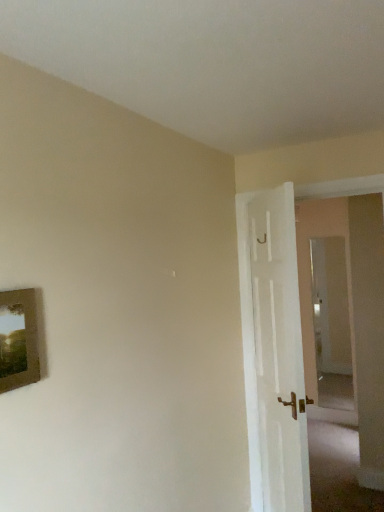
Question: From the image's perspective, is transparent glass door at right beneath wooden picture frame at left?

Choices:
 (A) no
 (B) yes

Answer: (B)

Question: Can you confirm if transparent glass door at right is thinner than wooden picture frame at left?

Choices:
 (A) no
 (B) yes

Answer: (B)

Question: Is the surface of transparent glass door at right in direct contact with wooden picture frame at left?

Choices:
 (A) no
 (B) yes

Answer: (A)

Question: From the image's perspective, is transparent glass door at right above wooden picture frame at left?

Choices:
 (A) no
 (B) yes

Answer: (A)

Question: Is transparent glass door at right oriented towards wooden picture frame at left?

Choices:
 (A) no
 (B) yes

Answer: (B)

Question: Is wooden picture frame at left in front of or behind white wooden door at right in the image?

Choices:
 (A) behind
 (B) front

Answer: (B)

Question: In terms of height, does wooden picture frame at left look taller or shorter compared to white wooden door at right?

Choices:
 (A) short
 (B) tall

Answer: (A)

Question: Is wooden picture frame at left to the left or to the right of white wooden door at right in the image?

Choices:
 (A) left
 (B) right

Answer: (A)

Question: From a real-world perspective, is wooden picture frame at left above or below white wooden door at right?

Choices:
 (A) above
 (B) below

Answer: (A)

Question: From the image's perspective, is transparent glass door at right above or below wooden picture frame at left?

Choices:
 (A) below
 (B) above

Answer: (A)

Question: Does point (331, 295) appear closer or farther from the camera than point (23, 344)?

Choices:
 (A) closer
 (B) farther

Answer: (B)

Question: In terms of width, does transparent glass door at right look wider or thinner when compared to wooden picture frame at left?

Choices:
 (A) thin
 (B) wide

Answer: (A)

Question: Is transparent glass door at right in front of or behind wooden picture frame at left in the image?

Choices:
 (A) front
 (B) behind

Answer: (B)

Question: From the image's perspective, is white wooden door at right above or below transparent glass door at right?

Choices:
 (A) above
 (B) below

Answer: (A)

Question: From a real-world perspective, is white wooden door at right physically located above or below transparent glass door at right?

Choices:
 (A) above
 (B) below

Answer: (A)